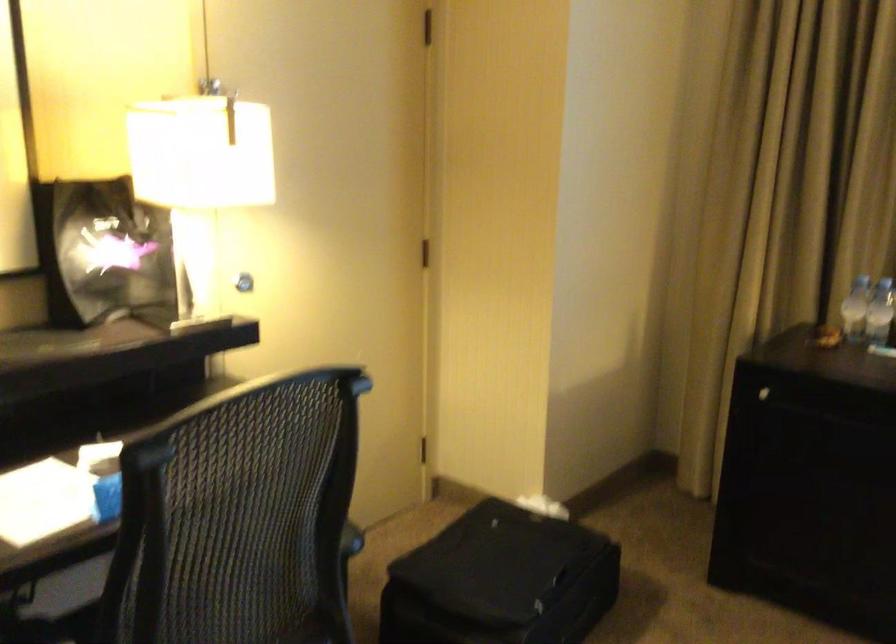
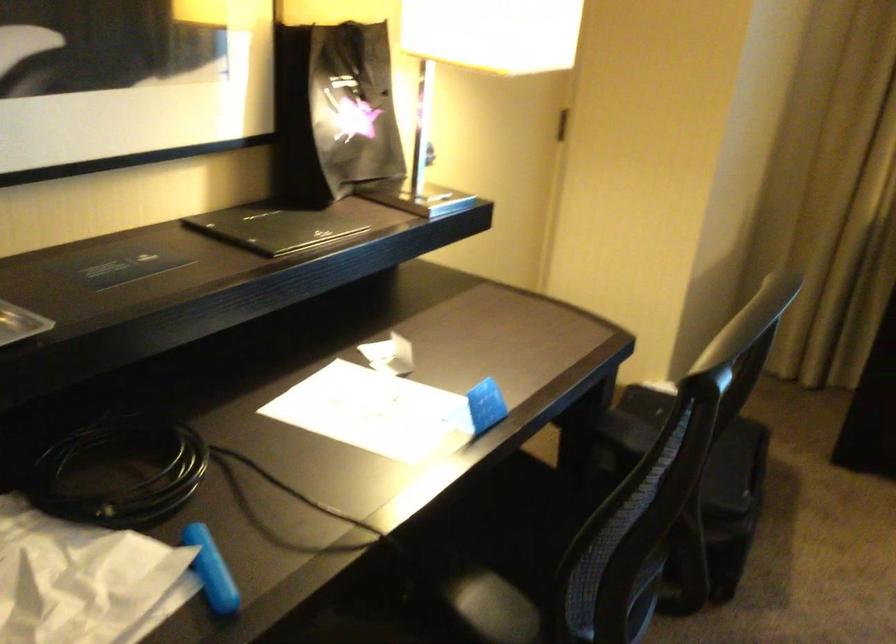
Question: Which direction would the cameraman need to move to produce the second image? Reply with the corresponding letter.

Choices:
 (A) Left
 (B) Right
 (C) Forward
 (D) Backward

Answer: (A)